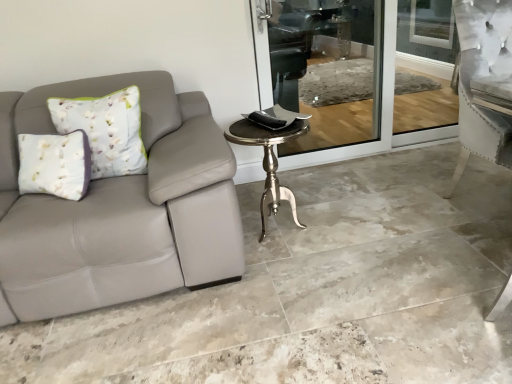
Image resolution: width=512 pixels, height=384 pixels. What are the coordinates of `vacant region above polished brass table at center (from a real-world perspective)` in the screenshot? It's located at (276, 123).